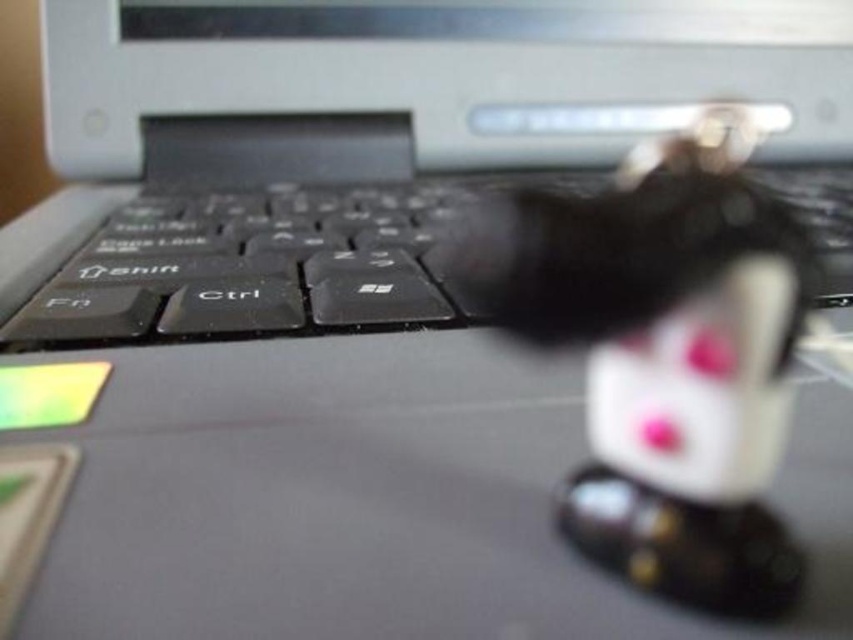
You need to place a keychain on the laptop surface without covering the keyboard. Given the white glossy rabbit at center and the black matte keyboard at center, which object should you place the keychain next to to ensure it doesn

The white glossy rabbit at center has a smaller size compared to the black matte keyboard at center, so placing the keychain next to the white glossy rabbit at center would leave more space for the keyboard.

You are trying to place a small toy on your laptop without blocking the keyboard. You have a white glossy rabbit at center and a black matte keyboard at center in view. Which object should you move to ensure the keyboard remains accessible?

The white glossy rabbit at center is located below the black matte keyboard at center. To keep the keyboard accessible, you should move the white glossy rabbit at center upwards so it doesn not block the keyboard.

You are trying to place a small object on the laptop keyboard without blocking any keys. The white glossy rabbit at center is currently on the keyboard. Is there enough space to move it to the right side of the Shift key without overlapping any keys?

The white glossy rabbit at center is located at point (665, 356), so moving it to the right side of the Shift key may or may not overlap with other keys depending on their positions. However, without specific key layout details, it is uncertain. Please check the keyboard layout for accurate placement.